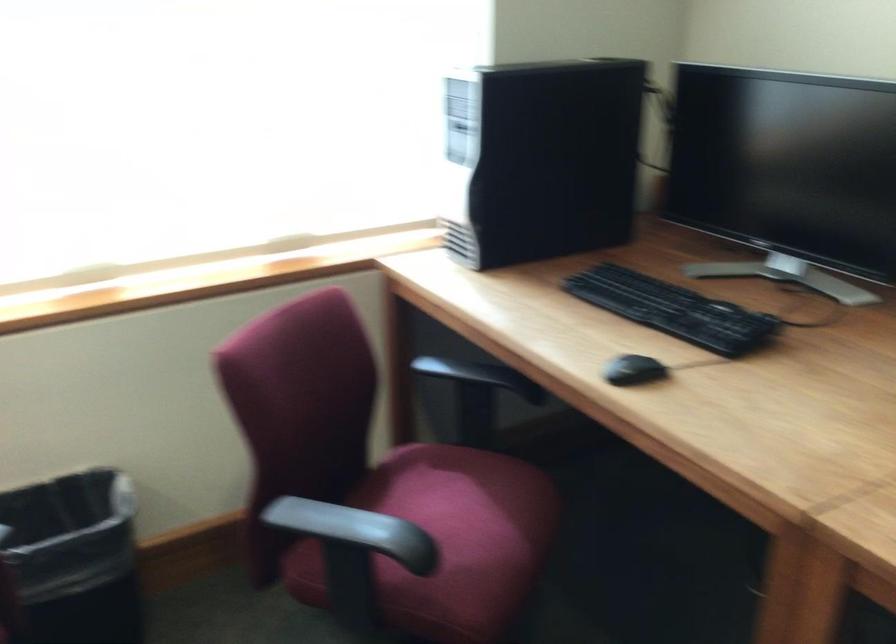
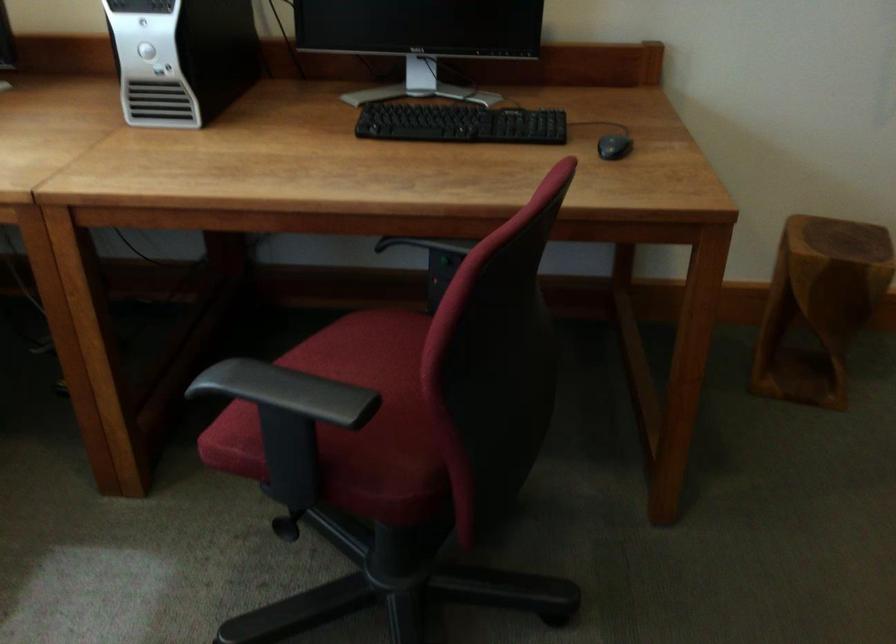
The images are taken continuously from a first-person perspective. In which direction is your viewpoint rotating?

The camera's rotation is toward right-down.